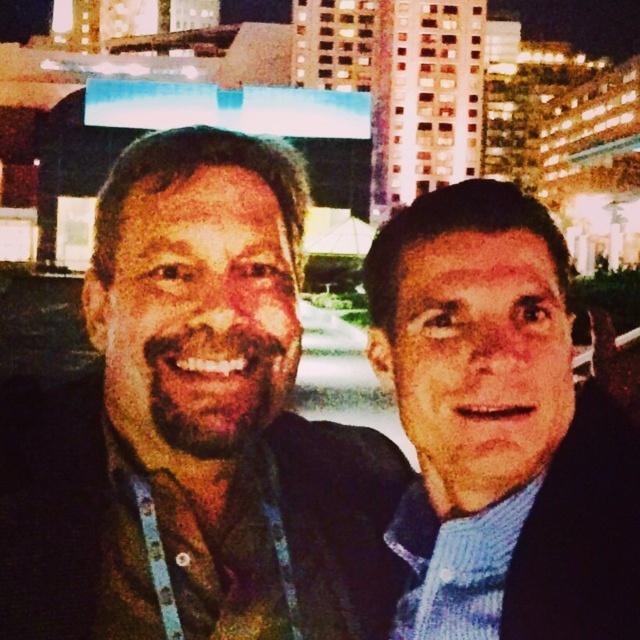
Question: Among these objects, which one is nearest to the camera?

Choices:
 (A) blue knit sweater at right
 (B) brown matte face at left
 (C) smooth skin face at center

Answer: (A)

Question: Does brown leather jacket at left lie behind smooth skin face at center?

Choices:
 (A) no
 (B) yes

Answer: (A)

Question: Does brown leather jacket at left appear under blue knit sweater at right?

Choices:
 (A) yes
 (B) no

Answer: (B)

Question: Is the position of brown matte face at left less distant than that of smooth skin face at center?

Choices:
 (A) yes
 (B) no

Answer: (A)

Question: Estimate the real-world distances between objects in this image. Which object is farther from the blue knit sweater at right?

Choices:
 (A) brown leather jacket at left
 (B) smooth skin face at center
 (C) brown matte face at left

Answer: (C)

Question: Estimate the real-world distances between objects in this image. Which object is closer to the smooth skin face at center?

Choices:
 (A) brown matte face at left
 (B) brown leather jacket at left
 (C) blue knit sweater at right

Answer: (C)